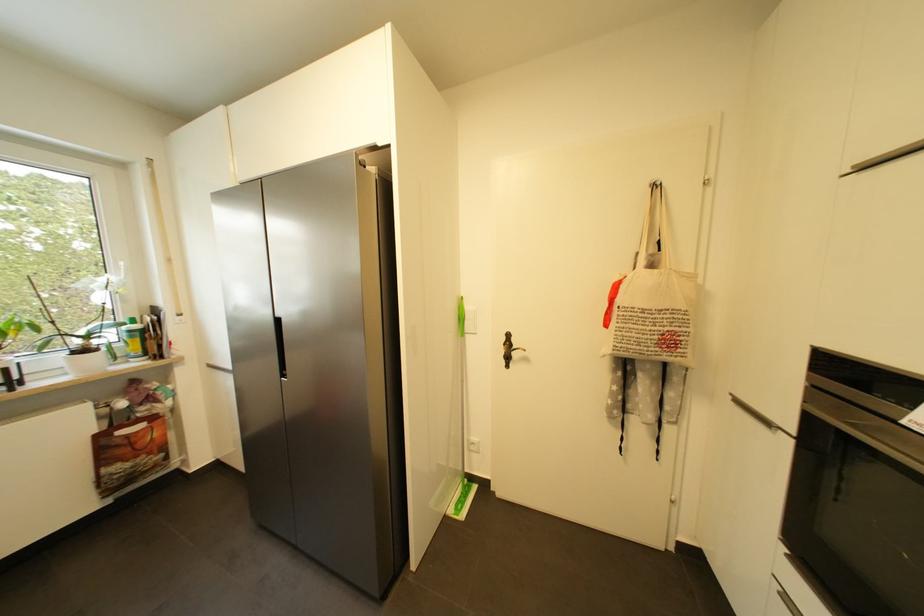
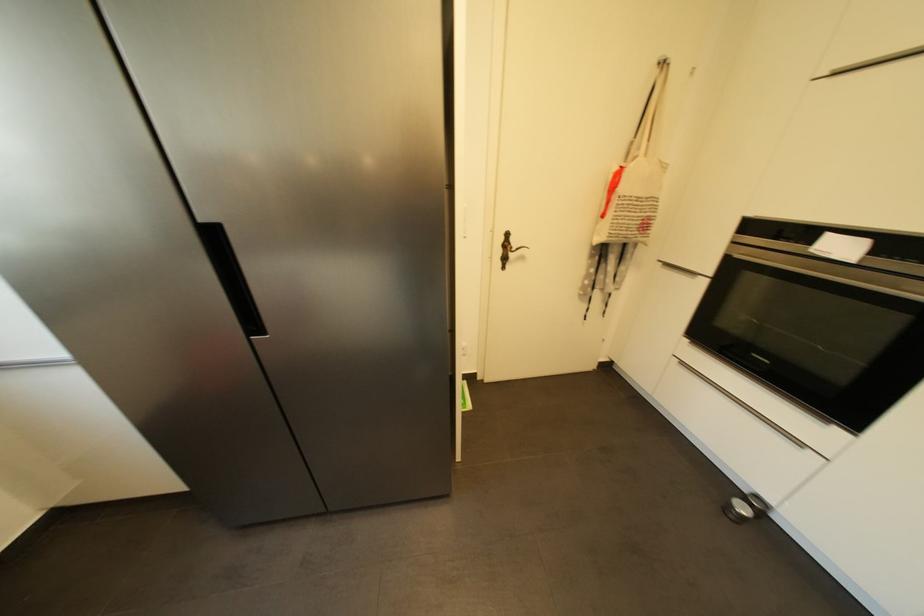
Looking at this image, how did the camera likely rotate?

The rotation direction of the camera is right-down.